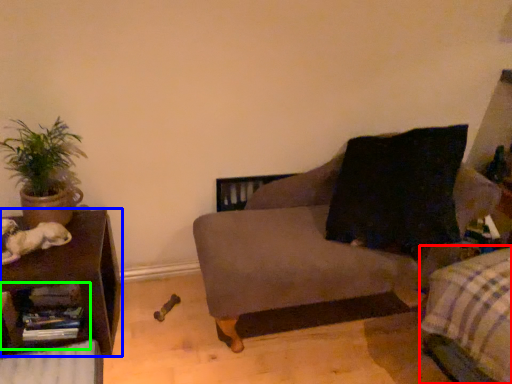
Question: Based on their relative distances, which object is nearer to bedding (highlighted by a red box)? Choose from table (highlighted by a blue box) and shelf (highlighted by a green box).

Choices:
 (A) table
 (B) shelf

Answer: (A)